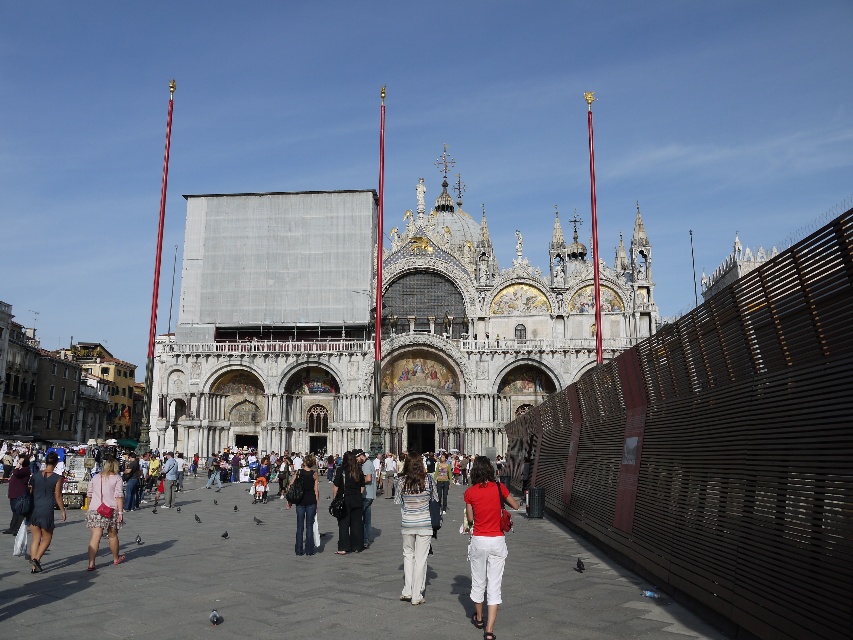
Who is more forward, (x=259, y=369) or (x=364, y=476)?

Point (x=364, y=476)

What do you see at coordinates (360, 326) in the screenshot? The width and height of the screenshot is (853, 640). I see `golden mosaic church at center` at bounding box center [360, 326].

Which is behind, point (469, 333) or point (373, 496)?

The point (469, 333) is more distant.

Identify the location of golden mosaic church at center. (360, 326).

Which is more to the right, pink fabric purse at lower left or dark brown leather jacket at center?

Positioned to the right is dark brown leather jacket at center.

Is point (117, 506) positioned in front of point (358, 540)?

Yes, it is in front of point (358, 540).

Which is behind, point (115, 477) or point (355, 550)?

Positioned behind is point (355, 550).

I want to click on pink fabric purse at lower left, so click(103, 509).

Who is taller, dark blue dress at lower left or dark brown leather jacket at center?

Standing taller between the two is dark brown leather jacket at center.

Based on the photo, is dark blue dress at lower left bigger than dark brown leather jacket at center?

Yes.

Find the location of a particular element. The width and height of the screenshot is (853, 640). dark blue dress at lower left is located at coordinates (44, 508).